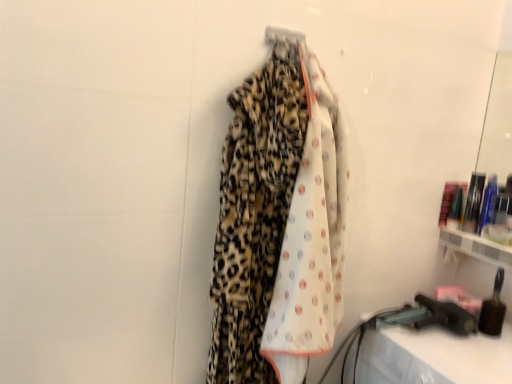
Question: Is leopard print fabric at center positioned behind metallic silver hanger at upper center?

Choices:
 (A) no
 (B) yes

Answer: (A)

Question: Does leopard print fabric at center have a larger size compared to metallic silver hanger at upper center?

Choices:
 (A) yes
 (B) no

Answer: (A)

Question: Considering the relative sizes of leopard print fabric at center and metallic silver hanger at upper center in the image provided, is leopard print fabric at center taller than metallic silver hanger at upper center?

Choices:
 (A) yes
 (B) no

Answer: (A)

Question: Is there a large distance between leopard print fabric at center and metallic silver hanger at upper center?

Choices:
 (A) no
 (B) yes

Answer: (A)

Question: Is leopard print fabric at center completely or partially outside of metallic silver hanger at upper center?

Choices:
 (A) yes
 (B) no

Answer: (A)

Question: Is leopard print fabric at center oriented away from metallic silver hanger at upper center?

Choices:
 (A) no
 (B) yes

Answer: (B)

Question: Is translucent plastic bottles at right, the 1th toiletry viewed from the back, to the right of metallic silver hanger at upper center from the viewer's perspective?

Choices:
 (A) yes
 (B) no

Answer: (A)

Question: Considering the relative sizes of translucent plastic bottles at right, the first toiletry from the top, and metallic silver hanger at upper center in the image provided, is translucent plastic bottles at right, the first toiletry from the top, shorter than metallic silver hanger at upper center?

Choices:
 (A) yes
 (B) no

Answer: (B)

Question: Is there a large distance between translucent plastic bottles at right, the second toiletry positioned from the bottom, and metallic silver hanger at upper center?

Choices:
 (A) yes
 (B) no

Answer: (B)

Question: From a real-world perspective, is translucent plastic bottles at right, the second toiletry positioned from the bottom, on top of metallic silver hanger at upper center?

Choices:
 (A) no
 (B) yes

Answer: (A)

Question: Is translucent plastic bottles at right, the first toiletry from the top, bigger than metallic silver hanger at upper center?

Choices:
 (A) yes
 (B) no

Answer: (A)

Question: Considering the relative positions of translucent plastic bottles at right, the 1th toiletry viewed from the back, and metallic silver hanger at upper center in the image provided, is translucent plastic bottles at right, the 1th toiletry viewed from the back, in front of metallic silver hanger at upper center?

Choices:
 (A) no
 (B) yes

Answer: (A)

Question: From a real-world perspective, is metallic silver hanger at upper center positioned over leopard print fabric at center based on gravity?

Choices:
 (A) no
 (B) yes

Answer: (B)